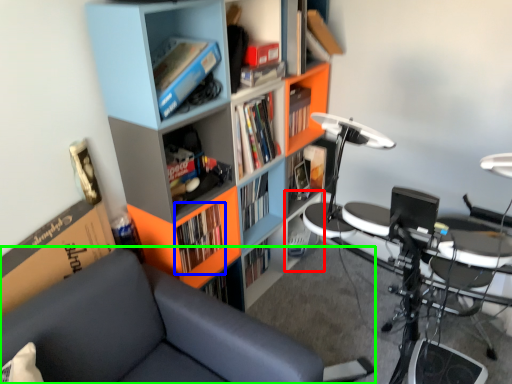
Question: Estimate the real-world distances between objects in this image. Which object is farther from cabinet (highlighted by a red box), book (highlighted by a blue box) or chair (highlighted by a green box)?

Choices:
 (A) book
 (B) chair

Answer: (B)